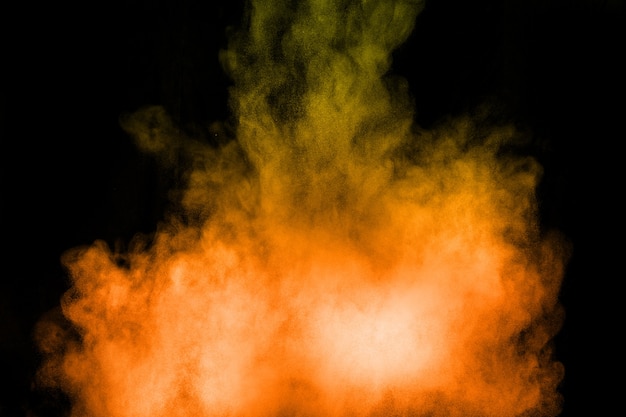
Locate an element on the screen. bottom edge of picture is located at coordinates (41, 415), (605, 415).